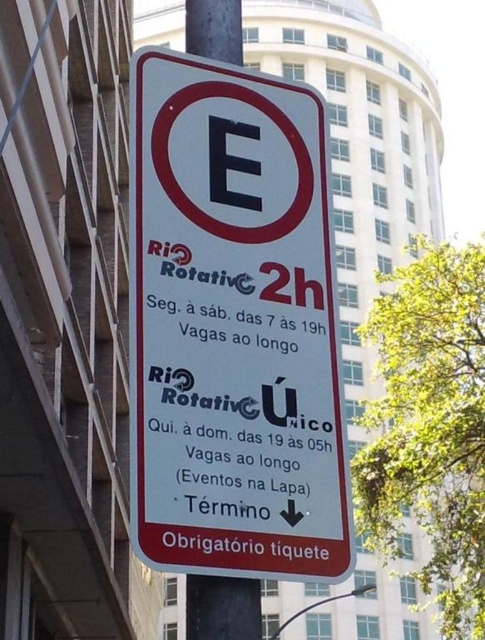
You are driving a car and need to park near the white plastic sign at center and the black metal pole at center. From the driver seat, which object do you see first when looking straight ahead?

The white plastic sign at center is in front of the black metal pole at center, so you will see the white plastic sign at center first when looking straight ahead.

You are a driver looking for a parking spot near the parking restriction sign. There is a white plastic sign at center with a point marked at coordinates (x=232, y=326). Can you park your car at the point marked by the coordinates on the white plastic sign at center?

The point marked at coordinates (x=232, y=326) is on the white plastic sign at center, so you cannot park there as it is part of the sign itself.

Looking at this image, you are a delivery driver who needs to park your van near the white plastic sign at center for a short delivery. The van is 7 meters long. Is there enough space to park the van safely without blocking the sign or the sidewalk?

The white plastic sign at center is located at point (232,326). However, the exact dimensions of the parking area around the sign are not provided in the scene description. Without knowing the available space, it is impossible to determine if the van can park safely. Please check the actual parking area dimensions before deciding.